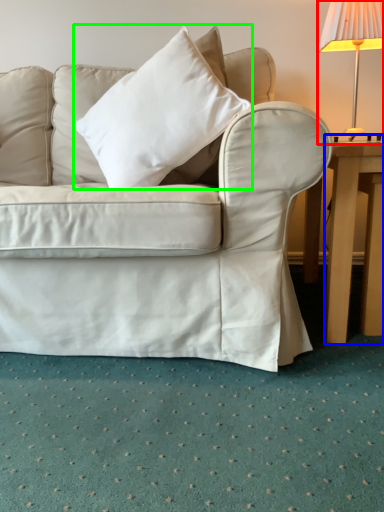
Question: Which is farther away from lamp (highlighted by a red box)? table (highlighted by a blue box) or pillow (highlighted by a green box)?

Choices:
 (A) table
 (B) pillow

Answer: (B)